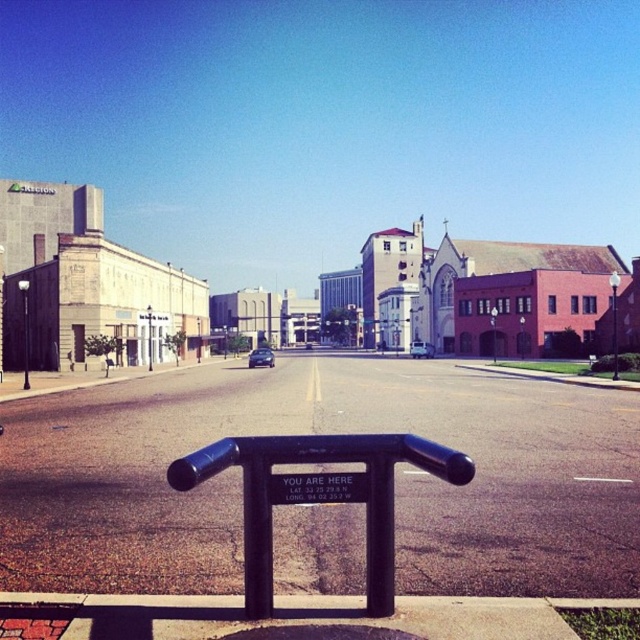
You are standing at the black metal railing and want to cross the street to the beige building with the KELION sign. There is a brushed metal pole at center and a shiny black sedan at center in your path. Which object do you need to go around first?

The brushed metal pole at center occupies less space than the shiny black sedan at center, so you should go around the shiny black sedan at center first as it takes up more space in your path.

You are a delivery driver needing to park your 15 feet long truck between the silver metallic sedan at center and the shiny black sedan at center. Can you fit your truck there?

The silver metallic sedan at center and shiny black sedan at center are 371.70 feet apart from each other, so yes, the truck can fit between them since the space is larger than the truck.

You are standing in the middle of the street and see the black matte rail at center and the brushed metal pole at center. Which object is nearer to you?

The black matte rail at center is closer to the viewer than the brushed metal pole at center.